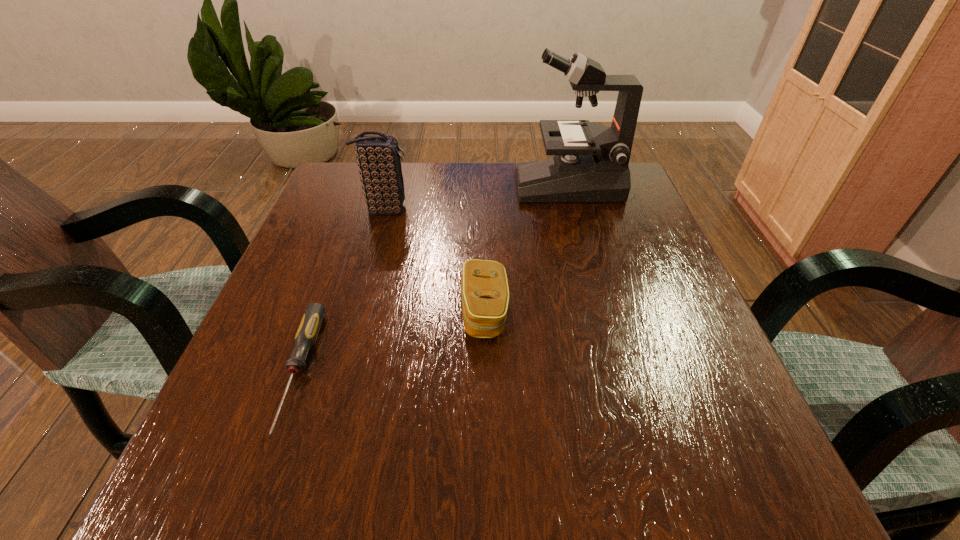
The image size is (960, 540). I want to click on microscope, so coord(590,164).

You are a GUI agent. You are given a task and a screenshot of the screen. Output one action in this format:
    pyautogui.click(x=<x>, y=<y>)
    Task: Click on the tallest object
    Image resolution: width=960 pixels, height=540 pixels.
    Given the screenshot: What is the action you would take?
    pyautogui.click(x=590, y=164)

This screenshot has height=540, width=960. Identify the location of the left clutch bag. (379, 163).

At what (x,y) coordinates should I click in order to perform the action: click on the second tallest object. Please return your answer as a coordinate pair (x, y). Looking at the image, I should click on (379, 163).

The height and width of the screenshot is (540, 960). I want to click on the second shortest object, so click(484, 288).

You are a GUI agent. You are given a task and a screenshot of the screen. Output one action in this format:
    pyautogui.click(x=<x>, y=<y>)
    Task: Click on the shorter clutch bag
    This screenshot has width=960, height=540.
    Given the screenshot: What is the action you would take?
    pyautogui.click(x=484, y=288)

Find the location of a particular element. Image resolution: width=960 pixels, height=540 pixels. the shortest object is located at coordinates (308, 330).

The height and width of the screenshot is (540, 960). I want to click on vacant space located through the eyepieces of the microscope, so click(465, 185).

The height and width of the screenshot is (540, 960). In order to click on free space located through the eyepieces of the microscope in this screenshot , I will do (x=377, y=185).

Find the location of a particular element. vacant area situated 0.180m through the eyepieces of the microscope is located at coordinates (444, 185).